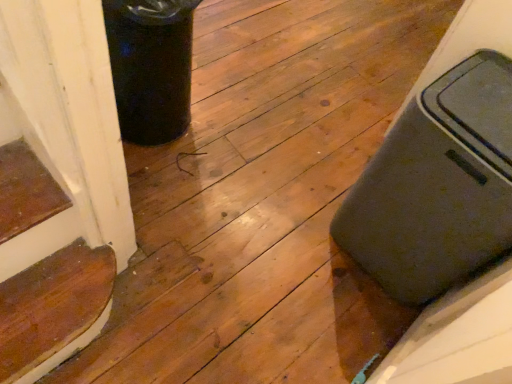
Question: Is wooden stair at lower left behind matte gray suitcase at right?

Choices:
 (A) yes
 (B) no

Answer: (A)

Question: Considering the relative sizes of wooden stair at lower left and matte gray suitcase at right in the image provided, is wooden stair at lower left shorter than matte gray suitcase at right?

Choices:
 (A) no
 (B) yes

Answer: (B)

Question: Does wooden stair at lower left appear on the left side of matte gray suitcase at right?

Choices:
 (A) yes
 (B) no

Answer: (A)

Question: From a real-world perspective, is wooden stair at lower left over matte gray suitcase at right?

Choices:
 (A) yes
 (B) no

Answer: (B)

Question: Is wooden stair at lower left aimed at matte gray suitcase at right?

Choices:
 (A) yes
 (B) no

Answer: (B)

Question: Considering the relative sizes of wooden stair at lower left and matte gray suitcase at right in the image provided, is wooden stair at lower left thinner than matte gray suitcase at right?

Choices:
 (A) yes
 (B) no

Answer: (A)

Question: Does matte gray suitcase at right have a larger size compared to wooden stair at lower left?

Choices:
 (A) no
 (B) yes

Answer: (B)

Question: From a real-world perspective, is matte gray suitcase at right physically above wooden stair at lower left?

Choices:
 (A) yes
 (B) no

Answer: (A)

Question: Does matte gray suitcase at right lie behind wooden stair at lower left?

Choices:
 (A) no
 (B) yes

Answer: (A)

Question: From the image's perspective, would you say matte gray suitcase at right is shown under wooden stair at lower left?

Choices:
 (A) yes
 (B) no

Answer: (B)

Question: Is wooden stair at lower left located within matte gray suitcase at right?

Choices:
 (A) no
 (B) yes

Answer: (A)

Question: Considering the relative sizes of matte gray suitcase at right and wooden stair at lower left in the image provided, is matte gray suitcase at right smaller than wooden stair at lower left?

Choices:
 (A) yes
 (B) no

Answer: (B)

Question: Is matte gray suitcase at right in front of or behind wooden stair at lower left in the image?

Choices:
 (A) behind
 (B) front

Answer: (B)